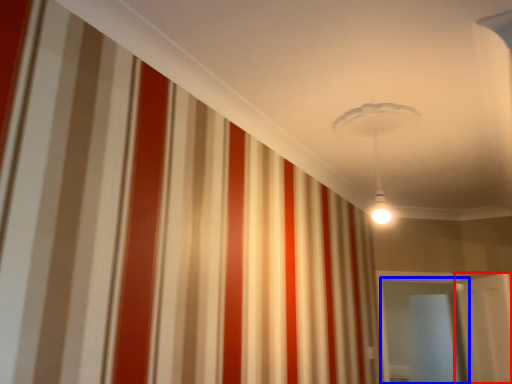
Question: Which object is further to the camera taking this photo, door (highlighted by a red box) or glass door (highlighted by a blue box)?

Choices:
 (A) door
 (B) glass door

Answer: (B)